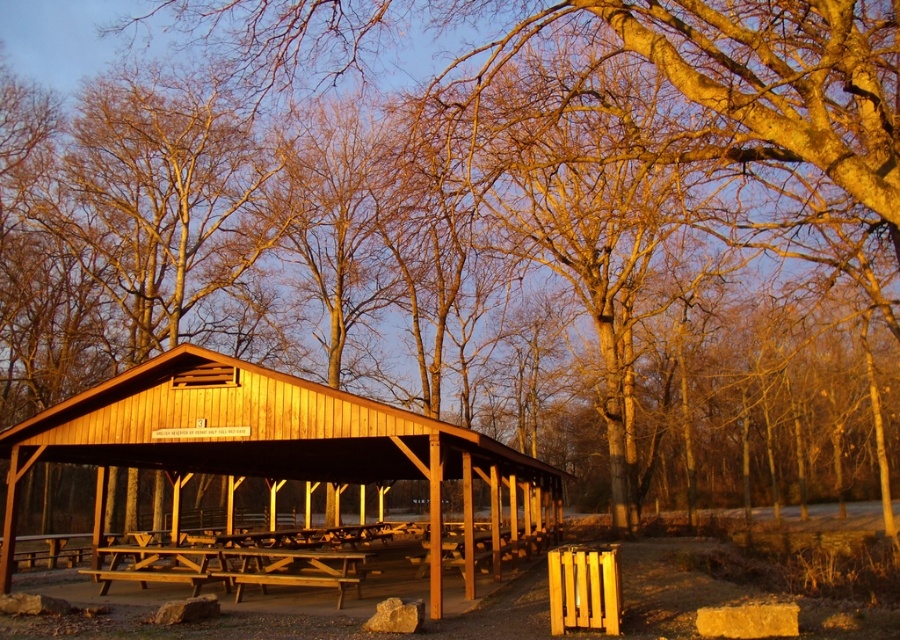
Which is above, wooden hut at center or wooden picnic table at center?

Positioned higher is wooden picnic table at center.

Is point (212, 456) in front of point (299, 577)?

No, (212, 456) is behind (299, 577).

Is point (352, 422) closer to viewer compared to point (101, 593)?

Yes.

The width and height of the screenshot is (900, 640). I want to click on wooden hut at center, so click(275, 451).